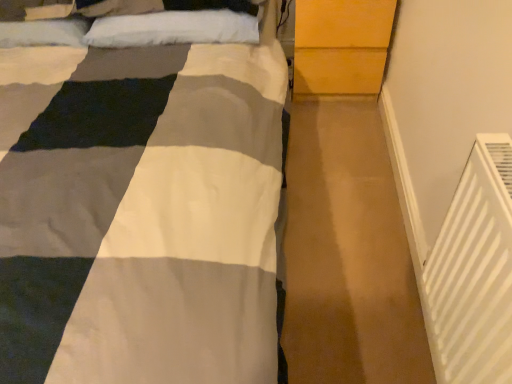
This screenshot has height=384, width=512. Find the location of `light brown wood dresser at upper right`. light brown wood dresser at upper right is located at coordinates (341, 46).

Describe the element at coordinates (474, 272) in the screenshot. I see `white plastic radiator at lower right` at that location.

Where is `light brown wood dresser at upper right`? The height and width of the screenshot is (384, 512). light brown wood dresser at upper right is located at coordinates pyautogui.click(x=341, y=46).

From the image's perspective, is light brown wood dresser at upper right located above or below white plastic radiator at lower right?

From the image's perspective, light brown wood dresser at upper right appears above white plastic radiator at lower right.

How different are the orientations of light brown wood dresser at upper right and white plastic radiator at lower right in degrees?

There is a 90-degree angle between the facing directions of light brown wood dresser at upper right and white plastic radiator at lower right.

From a real-world perspective, which object rests below the other?

In real-world perspective, light brown wood dresser at upper right is lower.

Looking at this image, would you say light brown wood dresser at upper right is outside white plastic radiator at lower right?

Yes, light brown wood dresser at upper right is not within white plastic radiator at lower right.

Is white fluffy pillow at upper center wider than light brown wood dresser at upper right?

In fact, white fluffy pillow at upper center might be narrower than light brown wood dresser at upper right.

In the scene shown: Considering the positions of objects white fluffy pillow at upper center and light brown wood dresser at upper right in the image provided, who is more to the right, white fluffy pillow at upper center or light brown wood dresser at upper right?

Positioned to the right is light brown wood dresser at upper right.

From a real-world perspective, between white fluffy pillow at upper center and light brown wood dresser at upper right, who is vertically lower?

light brown wood dresser at upper right is physically lower.

Which is in front, white fluffy pillow at upper center or light brown wood dresser at upper right?

Positioned in front is white fluffy pillow at upper center.

Is white fluffy pillow at upper center facing towards white plastic radiator at lower right?

Yes, white fluffy pillow at upper center faces towards white plastic radiator at lower right.

Is the surface of white fluffy pillow at upper center in direct contact with white plastic radiator at lower right?

No, white fluffy pillow at upper center is not next to white plastic radiator at lower right.

Considering the sizes of objects white fluffy pillow at upper center and white plastic radiator at lower right in the image provided, who is thinner, white fluffy pillow at upper center or white plastic radiator at lower right?

With smaller width is white plastic radiator at lower right.

Is white fluffy pillow at upper center taller than white plastic radiator at lower right?

In fact, white fluffy pillow at upper center may be shorter than white plastic radiator at lower right.

Considering the positions of objects white plastic radiator at lower right and white fluffy pillow at upper center in the image provided, who is behind, white plastic radiator at lower right or white fluffy pillow at upper center?

Positioned behind is white fluffy pillow at upper center.

Visually, is white plastic radiator at lower right positioned to the left or to the right of white fluffy pillow at upper center?

white plastic radiator at lower right is to the right of white fluffy pillow at upper center.

From the image's perspective, is white plastic radiator at lower right positioned above or below white fluffy pillow at upper center?

white plastic radiator at lower right is below white fluffy pillow at upper center.

Would you consider light brown wood dresser at upper right to be distant from white fluffy pillow at upper center?

Actually, light brown wood dresser at upper right and white fluffy pillow at upper center are a little close together.

From a real-world perspective, who is located higher, light brown wood dresser at upper right or white fluffy pillow at upper center?

white fluffy pillow at upper center, from a real-world perspective.

Can we say light brown wood dresser at upper right lies outside white fluffy pillow at upper center?

light brown wood dresser at upper right is positioned outside white fluffy pillow at upper center.

Which object is positioned more to the right, light brown wood dresser at upper right or white fluffy pillow at upper center?

light brown wood dresser at upper right.

From a real-world perspective, which is physically below, white plastic radiator at lower right or light brown wood dresser at upper right?

light brown wood dresser at upper right is physically lower.

Considering the sizes of white plastic radiator at lower right and light brown wood dresser at upper right in the image, is white plastic radiator at lower right wider or thinner than light brown wood dresser at upper right?

Clearly, white plastic radiator at lower right has less width compared to light brown wood dresser at upper right.

Considering the relative positions of white plastic radiator at lower right and light brown wood dresser at upper right in the image provided, is white plastic radiator at lower right to the left or to the right of light brown wood dresser at upper right?

From the image, it's evident that white plastic radiator at lower right is to the right of light brown wood dresser at upper right.

Is white plastic radiator at lower right spatially inside light brown wood dresser at upper right, or outside of it?

white plastic radiator at lower right cannot be found inside light brown wood dresser at upper right.

The width and height of the screenshot is (512, 384). Identify the location of air conditioning on the right of light brown wood dresser at upper right. (474, 272).

I want to click on pillow on the left of light brown wood dresser at upper right, so click(x=173, y=29).

Looking at the image, which one is located closer to light brown wood dresser at upper right, white plastic radiator at lower right or white fluffy pillow at upper center?

Based on the image, white fluffy pillow at upper center appears to be nearer to light brown wood dresser at upper right.

When comparing their distances from white fluffy pillow at upper center, does white plastic radiator at lower right or light brown wood dresser at upper right seem further?

Based on the image, white plastic radiator at lower right appears to be further to white fluffy pillow at upper center.

Looking at the image, which one is located closer to white fluffy pillow at upper center, light brown wood dresser at upper right or white plastic radiator at lower right?

light brown wood dresser at upper right is closer to white fluffy pillow at upper center.

Considering their positions, is white fluffy pillow at upper center positioned closer to light brown wood dresser at upper right than white plastic radiator at lower right?

The object closer to light brown wood dresser at upper right is white fluffy pillow at upper center.

Estimate the real-world distances between objects in this image. Which object is further from white plastic radiator at lower right, white fluffy pillow at upper center or light brown wood dresser at upper right?

white fluffy pillow at upper center is further to white plastic radiator at lower right.

When comparing their distances from white plastic radiator at lower right, does light brown wood dresser at upper right or white fluffy pillow at upper center seem closer?

light brown wood dresser at upper right is positioned closer to the anchor white plastic radiator at lower right.

Locate an element on the screen. The width and height of the screenshot is (512, 384). pillow between white plastic radiator at lower right and light brown wood dresser at upper right in the front-back direction is located at coordinates (173, 29).